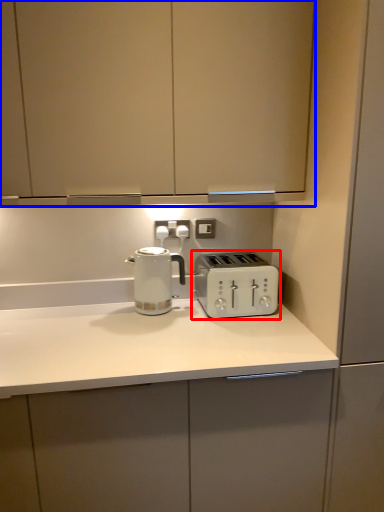
Question: Which object appears farthest to the camera in this image, toaster (highlighted by a red box) or cabinetry (highlighted by a blue box)?

Choices:
 (A) toaster
 (B) cabinetry

Answer: (A)